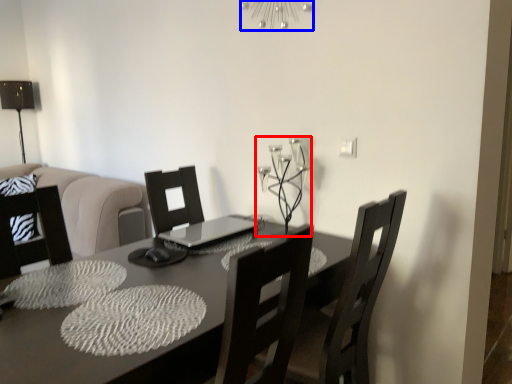
Question: Among these objects, which one is nearest to the camera, candle holder (highlighted by a red box) or light fixture (highlighted by a blue box)?

Choices:
 (A) candle holder
 (B) light fixture

Answer: (A)